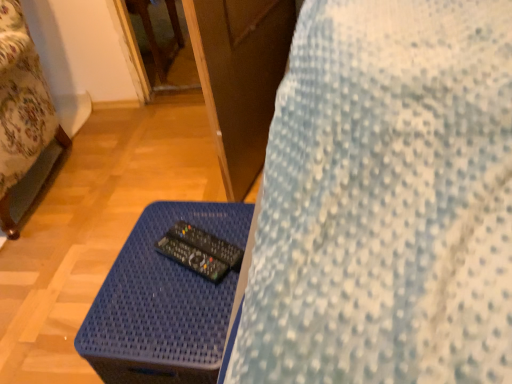
The width and height of the screenshot is (512, 384). What do you see at coordinates (192, 258) in the screenshot? I see `black plastic remote at center, arranged as the second control when viewed from the top` at bounding box center [192, 258].

This screenshot has width=512, height=384. What do you see at coordinates (207, 244) in the screenshot?
I see `black plastic remote at center, acting as the 2th control starting from the bottom` at bounding box center [207, 244].

At what (x,y) coordinates should I click in order to perform the action: click on black plastic remote at center, acting as the 2th control starting from the bottom. Please return your answer as a coordinate pair (x, y). This screenshot has height=384, width=512. Looking at the image, I should click on (207, 244).

What are the coordinates of `blue woven table at lower center` in the screenshot? It's located at (163, 303).

Identify the location of black plastic remote at center, arranged as the second control when viewed from the top. (192, 258).

Is wooden bed frame at left beside black plastic remote at center, placed as the 1th control when sorted from bottom to top?

No, wooden bed frame at left is not next to black plastic remote at center, placed as the 1th control when sorted from bottom to top.

Considering the sizes of objects wooden bed frame at left and black plastic remote at center, placed as the 1th control when sorted from bottom to top, in the image provided, who is taller, wooden bed frame at left or black plastic remote at center, placed as the 1th control when sorted from bottom to top,?

wooden bed frame at left is taller.

Which is more to the right, wooden bed frame at left or black plastic remote at center, placed as the 1th control when sorted from bottom to top?

black plastic remote at center, placed as the 1th control when sorted from bottom to top, is more to the right.

Considering the points (18, 163) and (173, 260), which point is in front, point (18, 163) or point (173, 260)?

The point (173, 260) is more forward.

How many degrees apart are the facing directions of blue woven table at lower center and black plastic remote at center, which is the 1th control in top-to-bottom order?

The facing directions of blue woven table at lower center and black plastic remote at center, which is the 1th control in top-to-bottom order, are 28.1 degrees apart.

Consider the image. Which is more to the left, blue woven table at lower center or black plastic remote at center, acting as the 2th control starting from the bottom?

Positioned to the left is blue woven table at lower center.

From a real-world perspective, is blue woven table at lower center positioned over black plastic remote at center, acting as the 2th control starting from the bottom, based on gravity?

Actually, blue woven table at lower center is physically below black plastic remote at center, acting as the 2th control starting from the bottom, in the real world.

Looking at this image, does blue woven table at lower center have a greater height compared to black plastic remote at center, which is the 1th control in top-to-bottom order?

Correct, blue woven table at lower center is much taller as black plastic remote at center, which is the 1th control in top-to-bottom order.

Measure the distance between wooden bed frame at left and blue woven table at lower center.

The distance of wooden bed frame at left from blue woven table at lower center is 29.13 inches.

Is wooden bed frame at left facing away from blue woven table at lower center?

wooden bed frame at left is not turned away from blue woven table at lower center.

From a real-world perspective, which object rests below the other?

In real-world perspective, blue woven table at lower center is lower.

Considering the positions of point (19, 39) and point (222, 322), is point (19, 39) closer or farther from the camera than point (222, 322)?

Clearly, point (19, 39) is more distant from the camera than point (222, 322).

Measure the distance from black plastic remote at center, arranged as the second control when viewed from the top, to black plastic remote at center, which is the 1th control in top-to-bottom order.

They are 1.27 inches apart.

This screenshot has height=384, width=512. I want to click on control above the black plastic remote at center, placed as the 1th control when sorted from bottom to top (from the image's perspective), so click(207, 244).

Looking at their sizes, would you say black plastic remote at center, placed as the 1th control when sorted from bottom to top, is wider or thinner than black plastic remote at center, acting as the 2th control starting from the bottom?

Clearly, black plastic remote at center, placed as the 1th control when sorted from bottom to top, has less width compared to black plastic remote at center, acting as the 2th control starting from the bottom.

From a real-world perspective, which is physically above, black plastic remote at center, arranged as the second control when viewed from the top, or black plastic remote at center, which is the 1th control in top-to-bottom order?

In real-world perspective, black plastic remote at center, which is the 1th control in top-to-bottom order, is above.

At what (x,y) coordinates should I click in order to perform the action: click on furniture to the left of black plastic remote at center, placed as the 1th control when sorted from bottom to top. Please return your answer as a coordinate pair (x, y). Looking at the image, I should click on (22, 114).

Are black plastic remote at center, placed as the 1th control when sorted from bottom to top, and wooden bed frame at left beside each other?

black plastic remote at center, placed as the 1th control when sorted from bottom to top, and wooden bed frame at left are not in contact.

In the image, is black plastic remote at center, placed as the 1th control when sorted from bottom to top, positioned in front of or behind wooden bed frame at left?

In the image, black plastic remote at center, placed as the 1th control when sorted from bottom to top, appears in front of wooden bed frame at left.

Considering the relative sizes of black plastic remote at center, arranged as the second control when viewed from the top, and wooden bed frame at left in the image provided, is black plastic remote at center, arranged as the second control when viewed from the top, shorter than wooden bed frame at left?

Indeed, black plastic remote at center, arranged as the second control when viewed from the top, has a lesser height compared to wooden bed frame at left.

From the picture: Is wooden bed frame at left not close to black plastic remote at center, which is the 1th control in top-to-bottom order?

They are positioned close to each other.

Which of these two, wooden bed frame at left or black plastic remote at center, acting as the 2th control starting from the bottom, stands shorter?

With less height is black plastic remote at center, acting as the 2th control starting from the bottom.

Can you confirm if wooden bed frame at left is thinner than black plastic remote at center, which is the 1th control in top-to-bottom order?

No.

Considering the points (4, 171) and (218, 246), which point is in front, point (4, 171) or point (218, 246)?

The point (218, 246) is closer.

Is black plastic remote at center, acting as the 2th control starting from the bottom, oriented towards blue woven table at lower center?

No.

Is black plastic remote at center, acting as the 2th control starting from the bottom, far from blue woven table at lower center?

No, there isn't a large distance between black plastic remote at center, acting as the 2th control starting from the bottom, and blue woven table at lower center.

From a real-world perspective, is black plastic remote at center, which is the 1th control in top-to-bottom order, located higher than blue woven table at lower center?

Yes.

Where is `furniture located on the left of black plastic remote at center, placed as the 1th control when sorted from bottom to top`? The height and width of the screenshot is (384, 512). furniture located on the left of black plastic remote at center, placed as the 1th control when sorted from bottom to top is located at coordinates (22, 114).

Find the location of a particular element. The image size is (512, 384). table directly beneath the black plastic remote at center, which is the 1th control in top-to-bottom order (from a real-world perspective) is located at coordinates (163, 303).

Looking at the image, which one is located closer to wooden bed frame at left, blue woven table at lower center or black plastic remote at center, placed as the 1th control when sorted from bottom to top?

blue woven table at lower center lies closer to wooden bed frame at left than the other object.

In the scene shown: Which object lies further to the anchor point black plastic remote at center, placed as the 1th control when sorted from bottom to top, black plastic remote at center, which is the 1th control in top-to-bottom order, or blue woven table at lower center?

blue woven table at lower center is further to black plastic remote at center, placed as the 1th control when sorted from bottom to top.

Looking at the image, which one is located closer to black plastic remote at center, arranged as the second control when viewed from the top, blue woven table at lower center or wooden bed frame at left?

blue woven table at lower center is positioned closer to the anchor black plastic remote at center, arranged as the second control when viewed from the top.

Which object lies nearer to the anchor point blue woven table at lower center, black plastic remote at center, arranged as the second control when viewed from the top, or wooden bed frame at left?

black plastic remote at center, arranged as the second control when viewed from the top, is closer to blue woven table at lower center.

From the image, which object appears to be nearer to blue woven table at lower center, black plastic remote at center, which is the 1th control in top-to-bottom order, or wooden bed frame at left?

black plastic remote at center, which is the 1th control in top-to-bottom order, lies closer to blue woven table at lower center than the other object.

When comparing their distances from black plastic remote at center, which is the 1th control in top-to-bottom order, does blue woven table at lower center or wooden bed frame at left seem further?

Among the two, wooden bed frame at left is located further to black plastic remote at center, which is the 1th control in top-to-bottom order.

Looking at the image, which one is located closer to wooden bed frame at left, black plastic remote at center, which is the 1th control in top-to-bottom order, or black plastic remote at center, arranged as the second control when viewed from the top?

black plastic remote at center, which is the 1th control in top-to-bottom order.

In the scene shown: When comparing their distances from blue woven table at lower center, does black plastic remote at center, placed as the 1th control when sorted from bottom to top, or black plastic remote at center, acting as the 2th control starting from the bottom, seem further?

The object further to blue woven table at lower center is black plastic remote at center, acting as the 2th control starting from the bottom.

Locate an element on the screen. This screenshot has width=512, height=384. control that lies between black plastic remote at center, which is the 1th control in top-to-bottom order, and blue woven table at lower center from top to bottom is located at coordinates tap(192, 258).

You are a GUI agent. You are given a task and a screenshot of the screen. Output one action in this format:
    pyautogui.click(x=<x>, y=<y>)
    Task: Click on the table between wooden bed frame at left and black plastic remote at center, acting as the 2th control starting from the bottom, from left to right
    Image resolution: width=512 pixels, height=384 pixels.
    Given the screenshot: What is the action you would take?
    pyautogui.click(x=163, y=303)

Where is `control located between wooden bed frame at left and black plastic remote at center, which is the 1th control in top-to-bottom order, in the left-right direction`? The width and height of the screenshot is (512, 384). control located between wooden bed frame at left and black plastic remote at center, which is the 1th control in top-to-bottom order, in the left-right direction is located at coordinates (192, 258).

At what (x,y) coordinates should I click in order to perform the action: click on table between wooden bed frame at left and black plastic remote at center, arranged as the second control when viewed from the top, from left to right. Please return your answer as a coordinate pair (x, y). Image resolution: width=512 pixels, height=384 pixels. Looking at the image, I should click on (163, 303).